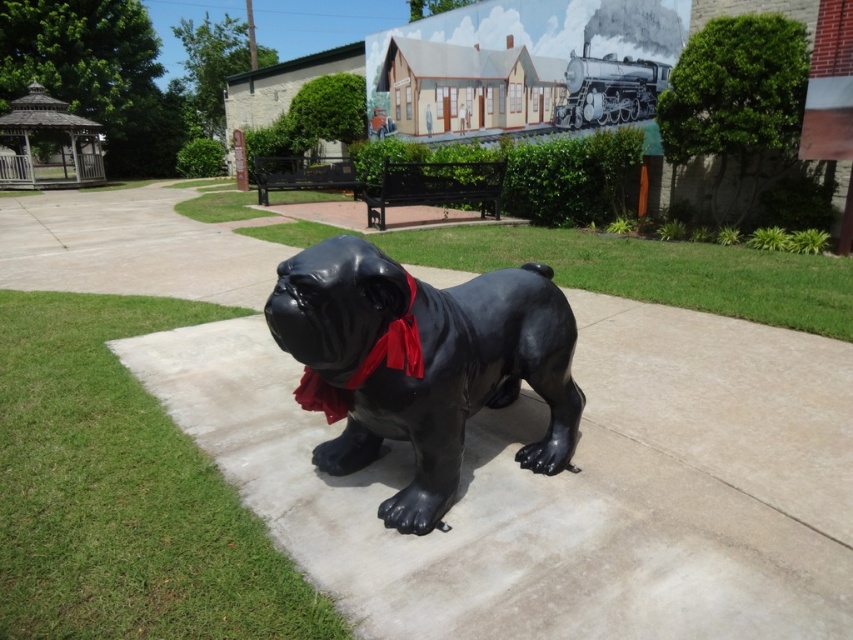
You are standing in the park and want to take a photo of the glossy black dog at center. If your camera can focus on objects up to 6 feet away, will you need to move closer to take a clear photo?

The glossy black dog at center is 6.62 feet away from viewer. Since the camera can only focus up to 6 feet, you need to move closer to ensure the glossy black dog at center is within the focus range.

You are standing at the entrance of the park and want to find the glossy black dog at center. According to the coordinates provided, in which direction should you walk from the entrance to reach it?

The glossy black dog at center is located at coordinates point (421,364), which means it is positioned slightly to the right and forward from the entrance. You should walk towards the center of the park, slightly to the right to reach it.

Based on the photo, you are a sculptor who wants to place a new decorative item between the glossy black dog at center and the red satin neckband at center. Can you fit a 5 inch wide decorative item between them?

The glossy black dog at center and red satin neckband at center are 10.96 inches apart from each other. A 5 inch wide decorative item can fit between them since the space is larger than the item.